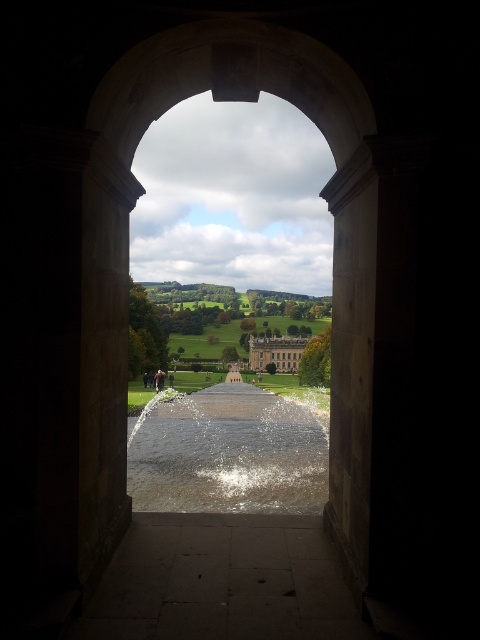
Question: Estimate the real-world distances between objects in this image. Which object is closer to the stone gray palace at center?

Choices:
 (A) clear water at center
 (B) dark stone path at center

Answer: (A)

Question: Considering the relative positions of dark stone path at center and stone gray palace at center in the image provided, where is dark stone path at center located with respect to stone gray palace at center?

Choices:
 (A) below
 (B) above

Answer: (B)

Question: Considering the relative positions of dark stone path at center and clear water at center in the image provided, where is dark stone path at center located with respect to clear water at center?

Choices:
 (A) right
 (B) left

Answer: (A)

Question: In this image, where is clear water at center located relative to stone gray palace at center?

Choices:
 (A) right
 (B) left

Answer: (B)

Question: Estimate the real-world distances between objects in this image. Which object is closer to the dark stone path at center?

Choices:
 (A) stone gray palace at center
 (B) clear water at center

Answer: (B)

Question: Which point is farther to the camera?

Choices:
 (A) dark stone path at center
 (B) clear water at center

Answer: (B)